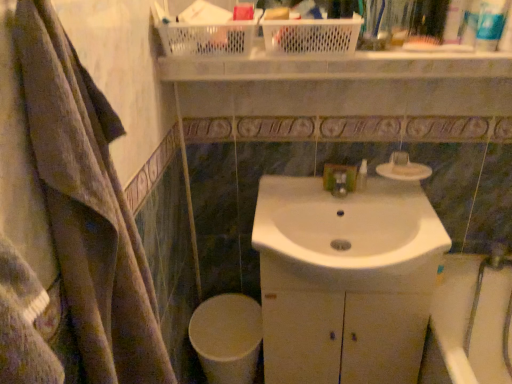
What are the coordinates of `free space above white plastic basket at upper center, arranged as the 1th basket when viewed from the right (from a real-world perspective)` in the screenshot? It's located at (308, 16).